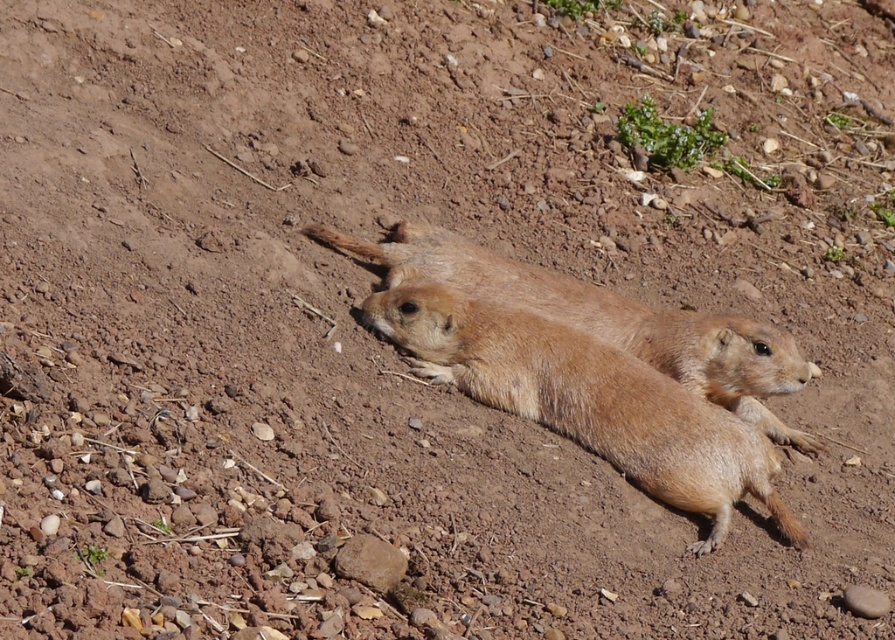
Is the position of furry golden ground squirrel at center less distant than that of brown furry ground squirrel at center?

Yes, furry golden ground squirrel at center is closer to the viewer.

Does point (391, 308) come farther from viewer compared to point (556, 310)?

No.

Where is `furry golden ground squirrel at center`? The height and width of the screenshot is (640, 895). furry golden ground squirrel at center is located at coordinates (587, 400).